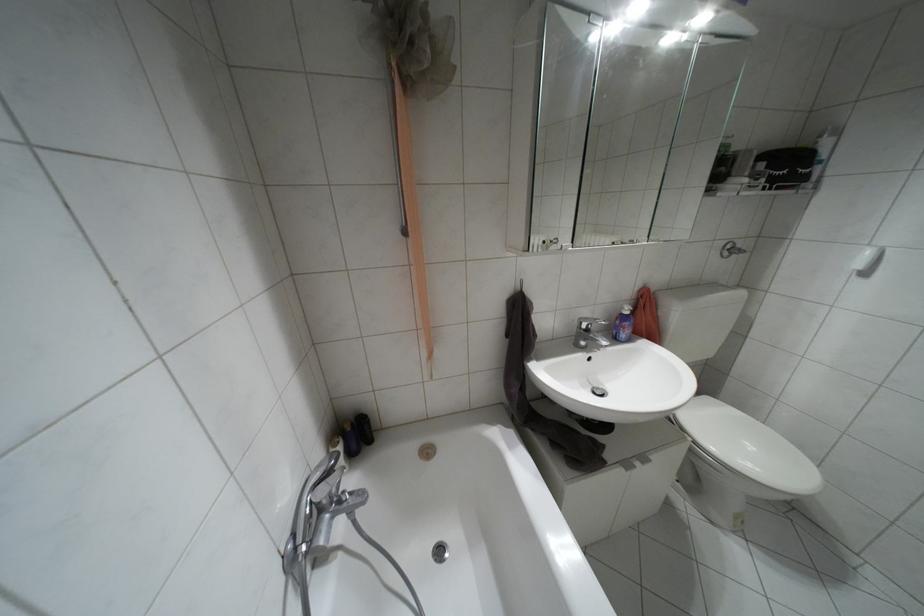
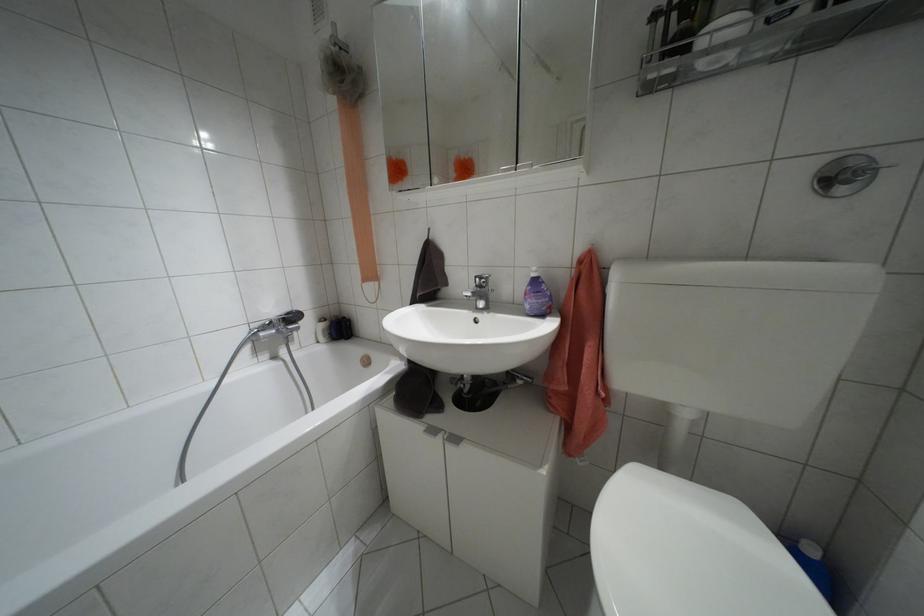
In the second image, find the point that corresponds to point 587,330 in the first image.

(479, 286)